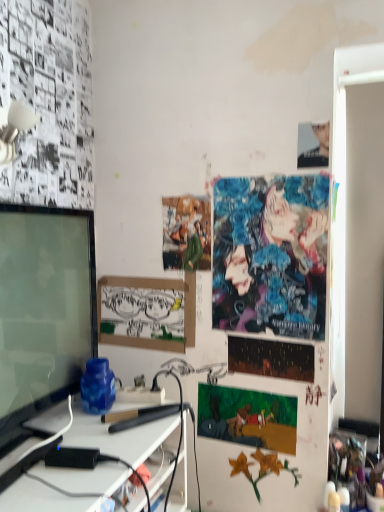
Question: Considering the relative sizes of matte black monitor at left and cartoon paper at center, the 4th poster page when ordered from top to bottom, in the image provided, is matte black monitor at left smaller than cartoon paper at center, the 4th poster page when ordered from top to bottom,?

Choices:
 (A) yes
 (B) no

Answer: (B)

Question: From a real-world perspective, is matte black monitor at left positioned over cartoon paper at center, the 4th poster page when ordered from top to bottom, based on gravity?

Choices:
 (A) yes
 (B) no

Answer: (A)

Question: From the image's perspective, is matte black monitor at left on cartoon paper at center, the 4th poster page when ordered from top to bottom?

Choices:
 (A) yes
 (B) no

Answer: (A)

Question: From the image's perspective, is matte black monitor at left below cartoon paper at center, arranged as the 1th poster page when ordered from the bottom?

Choices:
 (A) no
 (B) yes

Answer: (A)

Question: Does matte black monitor at left have a greater width compared to cartoon paper at center, arranged as the 1th poster page when ordered from the bottom?

Choices:
 (A) yes
 (B) no

Answer: (A)

Question: Is point (127, 301) positioned closer to the camera than point (23, 334)?

Choices:
 (A) farther
 (B) closer

Answer: (A)

Question: Is white paper at center in front of or behind matte black monitor at left in the image?

Choices:
 (A) front
 (B) behind

Answer: (B)

Question: Considering the positions of white paper at center and matte black monitor at left in the image, is white paper at center taller or shorter than matte black monitor at left?

Choices:
 (A) tall
 (B) short

Answer: (B)

Question: From the image's perspective, is white paper at center above or below matte black monitor at left?

Choices:
 (A) below
 (B) above

Answer: (A)

Question: Do you think matte black monitor at left is within vibrant digital art at upper right, the third poster page positioned from the bottom, or outside of it?

Choices:
 (A) outside
 (B) inside

Answer: (A)

Question: Relative to vibrant digital art at upper right, the third poster page positioned from the bottom, is matte black monitor at left in front or behind?

Choices:
 (A) behind
 (B) front

Answer: (B)

Question: Is matte black monitor at left wider or thinner than vibrant digital art at upper right, the 2th poster page in the top-to-bottom sequence?

Choices:
 (A) wide
 (B) thin

Answer: (A)

Question: From a real-world perspective, relative to vibrant digital art at upper right, the 2th poster page in the top-to-bottom sequence, is matte black monitor at left vertically above or below?

Choices:
 (A) below
 (B) above

Answer: (A)

Question: Is matte green fabric poster at center, acting as the fourth poster page starting from the bottom, situated inside dark matte poster at center, which is the 3th poster page in top-to-bottom order, or outside?

Choices:
 (A) inside
 (B) outside

Answer: (B)

Question: Looking at their shapes, would you say matte green fabric poster at center, acting as the fourth poster page starting from the bottom, is wider or thinner than dark matte poster at center, which is the 3th poster page in top-to-bottom order?

Choices:
 (A) thin
 (B) wide

Answer: (B)